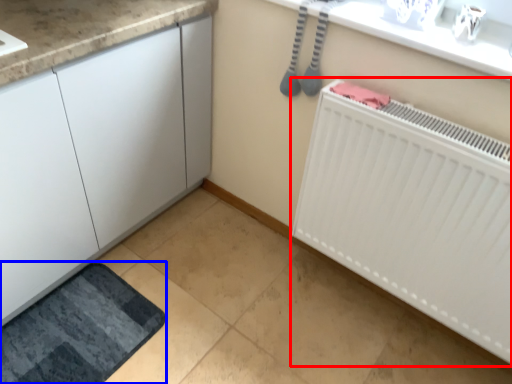
Question: Which point is closer to the camera, radiator (highlighted by a red box) or bath mat (highlighted by a blue box)?

Choices:
 (A) radiator
 (B) bath mat

Answer: (A)